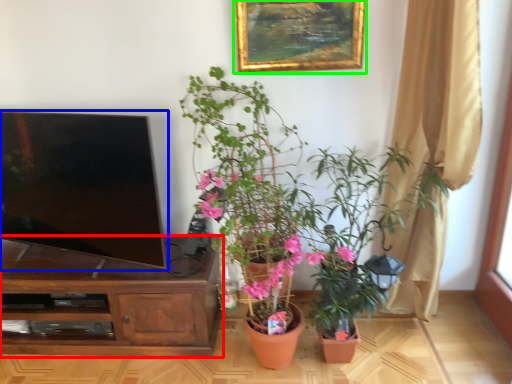
Question: Estimate the real-world distances between objects in this image. Which object is closer to cabinetry (highlighted by a red box), television (highlighted by a blue box) or picture frame (highlighted by a green box)?

Choices:
 (A) television
 (B) picture frame

Answer: (A)